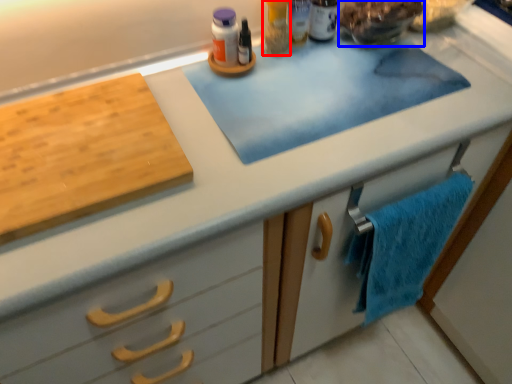
Question: Among these objects, which one is nearest to the camera, toiletry (highlighted by a red box) or food (highlighted by a blue box)?

Choices:
 (A) toiletry
 (B) food

Answer: (B)